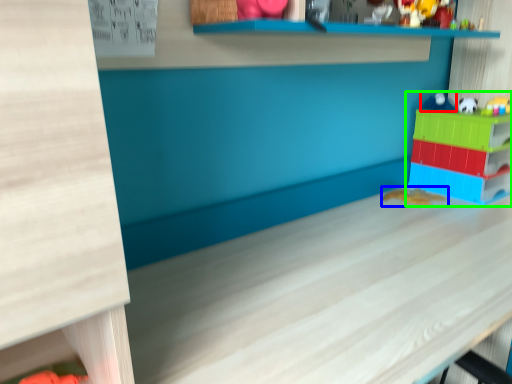
Question: Estimate the real-world distances between objects in this image. Which object is closer to toy (highlighted by a red box), toy (highlighted by a blue box) or toy (highlighted by a green box)?

Choices:
 (A) toy
 (B) toy

Answer: (B)